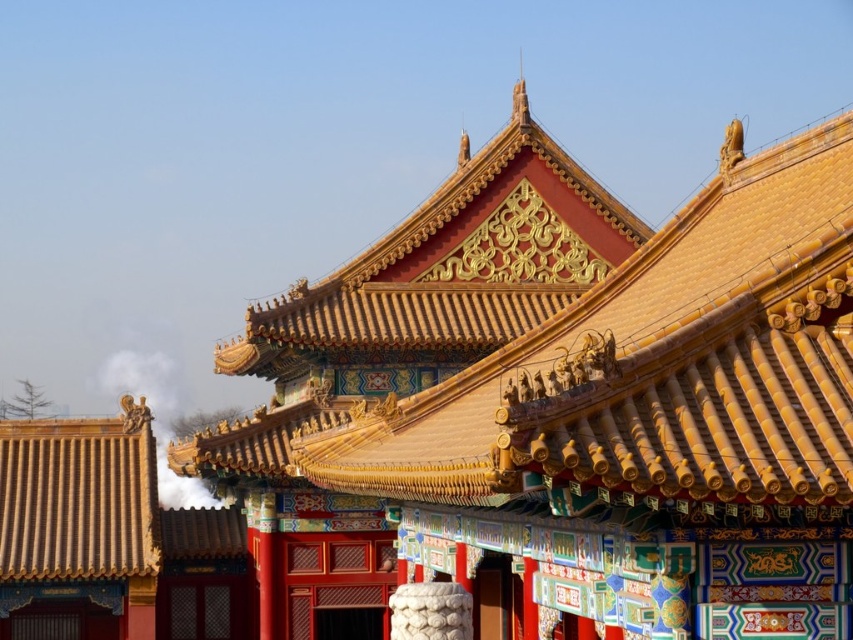
You are standing in front of a traditional Chinese building with ornate golden roofs and colorful walls. You notice two points marked on the structure. One is at coordinate point (310, 620) and the other at point (160, 474). Which of these two points is closer to you?

Point (310, 620) is in front of point (160, 474), so it is closer to you.

You are an architect analyzing the traditional Chinese building shown. You notice the golden glazed tiles at center and the white smoke at roof top. Which object is positioned higher in the structure?

The golden glazed tiles at center has a greater height compared to white smoke at roof top, so the golden glazed tiles at center is positioned higher in the structure.

You are an architect examining this traditional Chinese structure. You notice the golden glazed tiles at center and the white smoke at roof top. Which object is positioned closer to your viewpoint?

The golden glazed tiles at center are closer to the viewer than the white smoke at roof top.